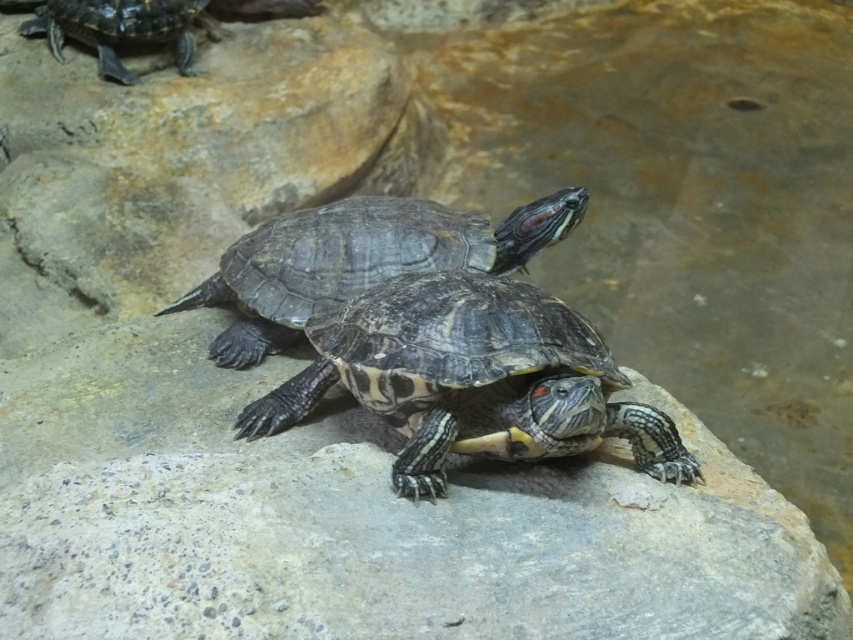
Can you confirm if shiny dark brown tortoise at center is positioned to the right of shiny black tortoise at upper left?

Yes, shiny dark brown tortoise at center is to the right of shiny black tortoise at upper left.

Who is more forward, (x=375, y=208) or (x=106, y=65)?

Positioned in front is point (x=375, y=208).

Find the location of `shiny dark brown tortoise at center`. shiny dark brown tortoise at center is located at coordinates (358, 259).

At what (x,y) coordinates should I click in order to perform the action: click on shiny dark brown tortoise at center. Please return your answer as a coordinate pair (x, y). Looking at the image, I should click on (358, 259).

Between patterned shell turtle at center and shiny black tortoise at upper left, which one appears on the left side from the viewer's perspective?

Positioned to the left is shiny black tortoise at upper left.

In the scene shown: Which is below, patterned shell turtle at center or shiny black tortoise at upper left?

patterned shell turtle at center is below.

Does point (529, 420) lie behind point (123, 35)?

No, (529, 420) is closer to viewer.

You are a GUI agent. You are given a task and a screenshot of the screen. Output one action in this format:
    pyautogui.click(x=<x>, y=<y>)
    Task: Click on the patterned shell turtle at center
    
    Given the screenshot: What is the action you would take?
    pyautogui.click(x=471, y=378)

In the scene shown: Between patterned shell turtle at center and shiny dark brown tortoise at center, which one is positioned higher?

shiny dark brown tortoise at center is above.

Is patterned shell turtle at center behind shiny dark brown tortoise at center?

That is False.

Find the location of a particular element. patterned shell turtle at center is located at coordinates (471, 378).